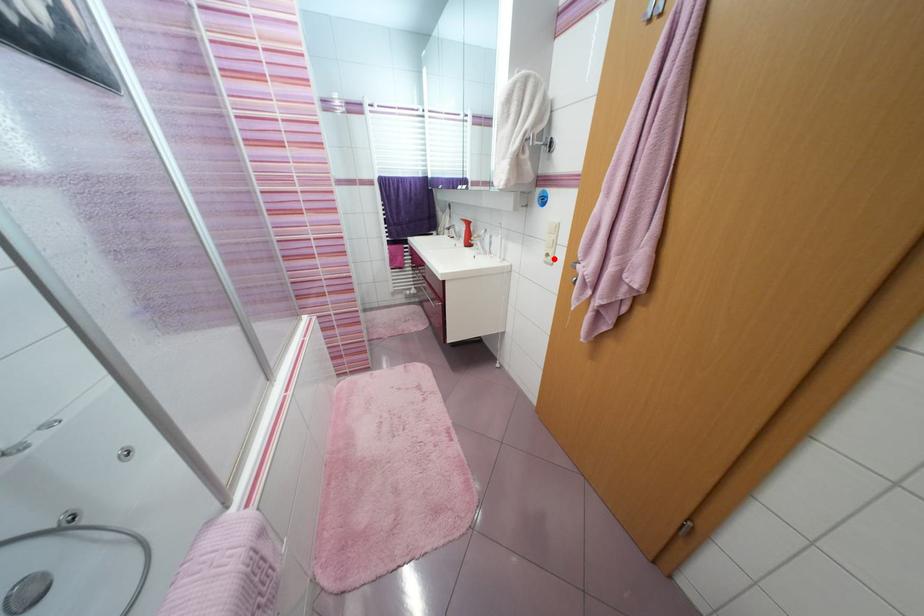
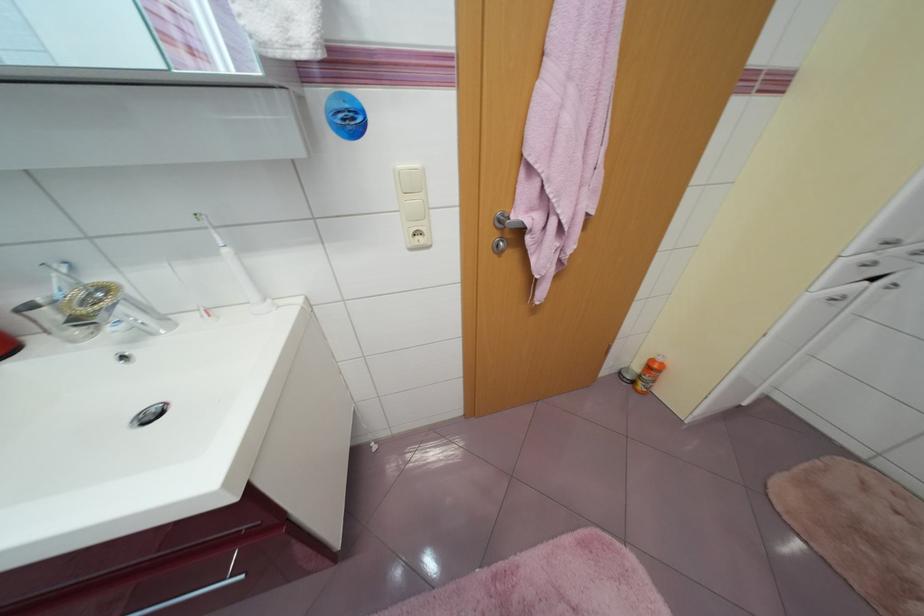
Where in the second image is the point corresponding to the highlighted location from the first image?

(423, 238)